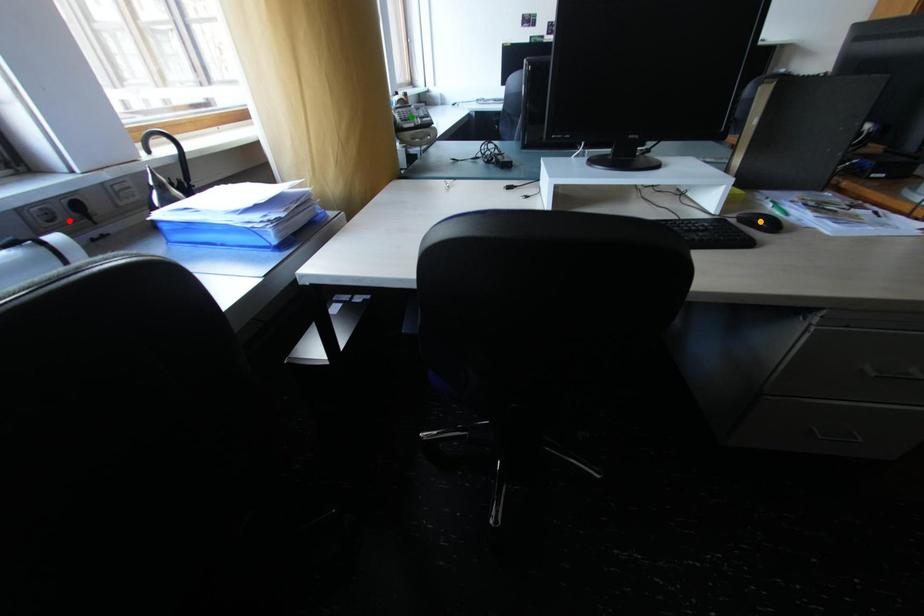
Order these from nearest to farthest:
green point
orange point
red point

red point → orange point → green point